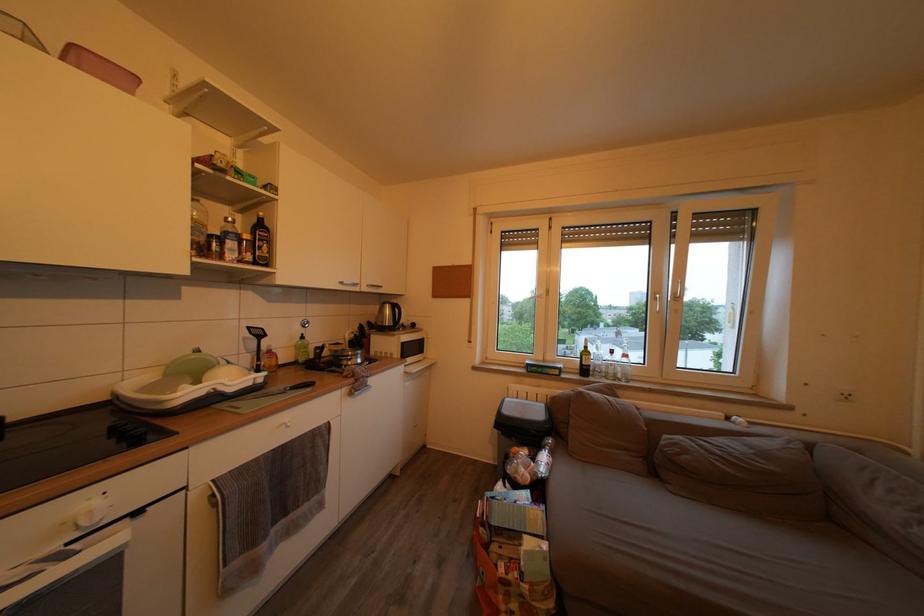
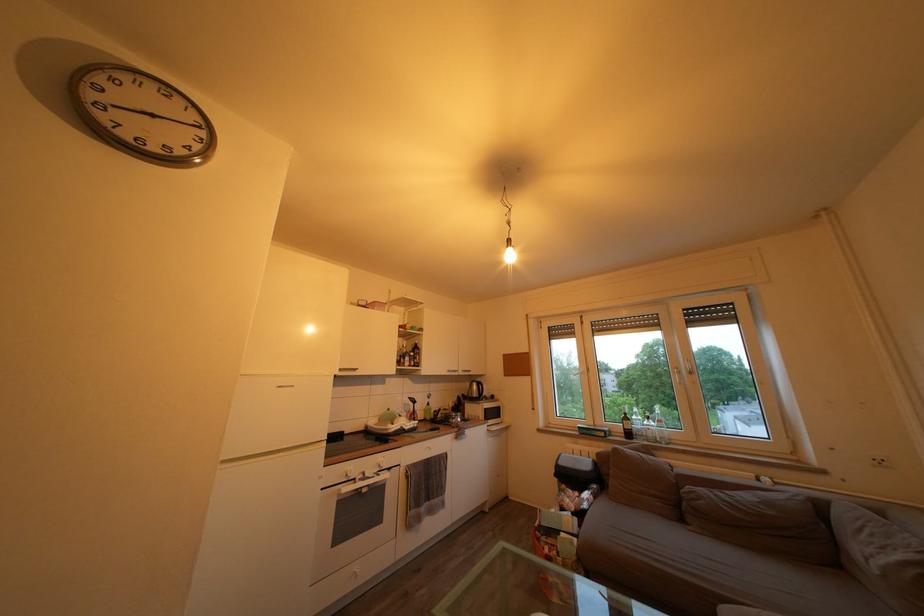
Locate, in the second image, the point that corresponds to (772,462) in the first image.

(774, 509)